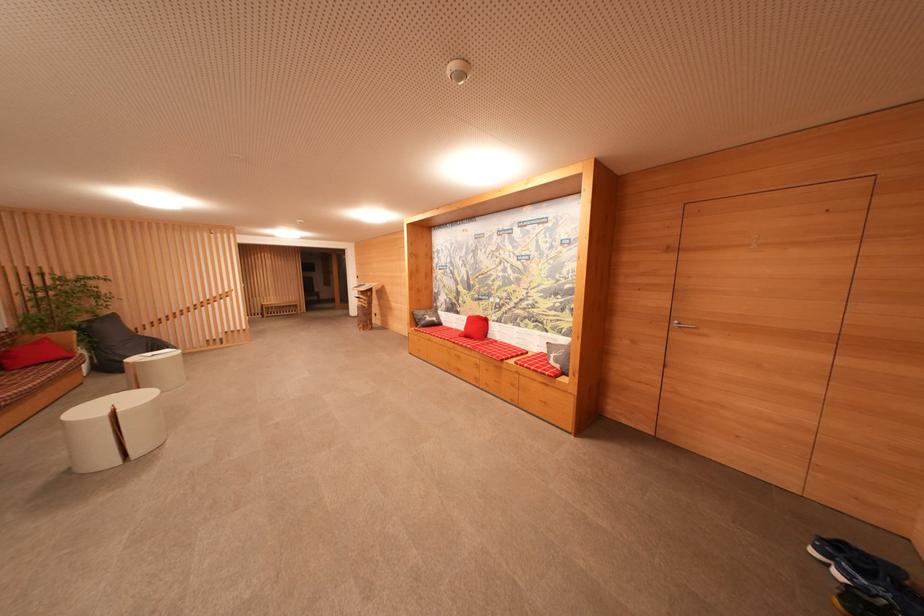
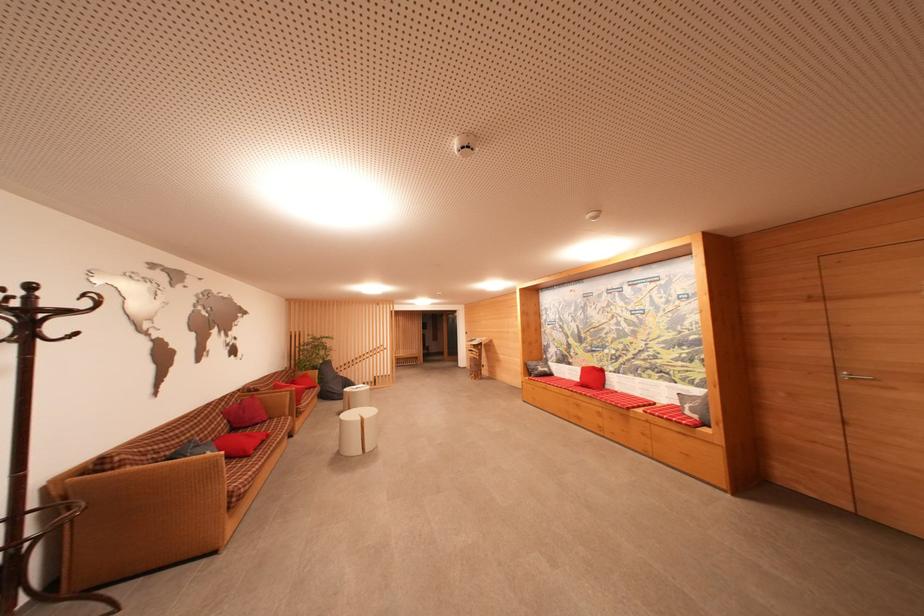
The point at (432, 322) is marked in the first image. Where is the corresponding point in the second image?

(544, 371)